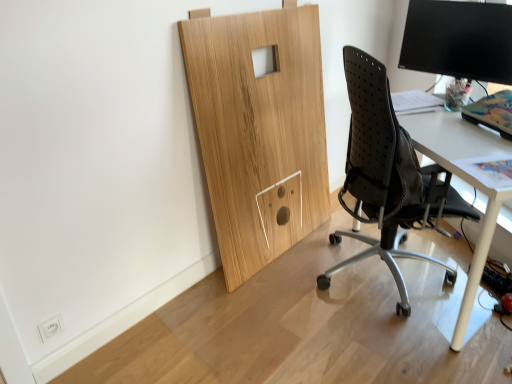
Locate an element on the screen. The height and width of the screenshot is (384, 512). free location above black glossy monitor at upper right (from a real-world perspective) is located at coordinates (466, 2).